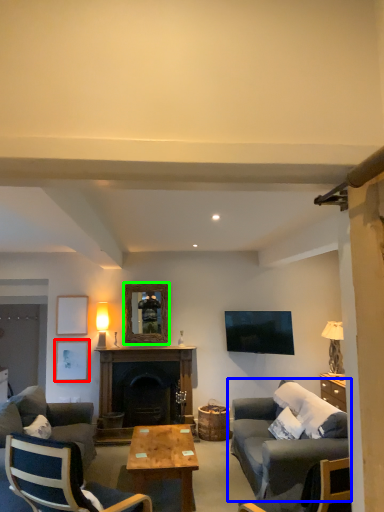
Question: Considering the real-world distances, which object is closest to picture frame (highlighted by a red box)? studio couch (highlighted by a blue box) or picture frame (highlighted by a green box).

Choices:
 (A) studio couch
 (B) picture frame

Answer: (B)